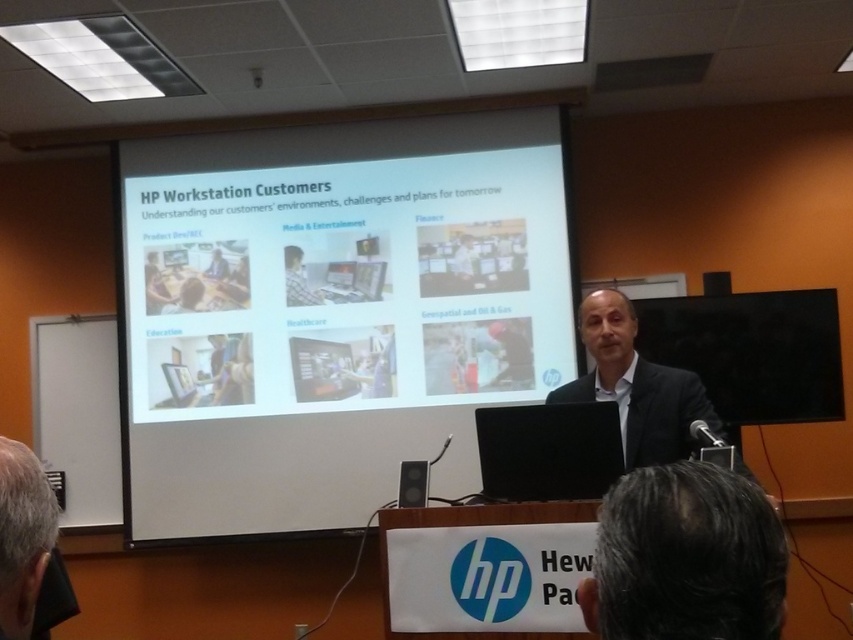
You are attending a presentation and notice two elements in the image. One is the dark brown hair at lower center and the other is the black smooth suit at center. Which of these two elements is positioned closer to the front of the scene?

The dark brown hair at lower center is closer to the viewer than the black smooth suit at center, so it is positioned closer to the front of the scene.

You are an attendee at the presentation and want to point out two specific points on the slide. The first point is at coordinates point (662, 637) and the second is at point (625, 465). Which of these points is closer to you?

Point (662, 637) is closer to the viewer than point (625, 465).